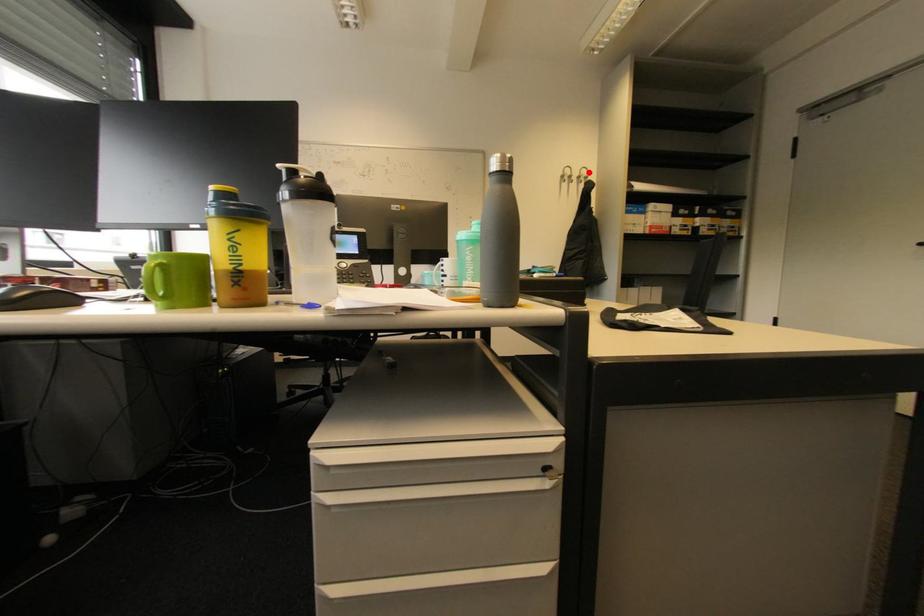
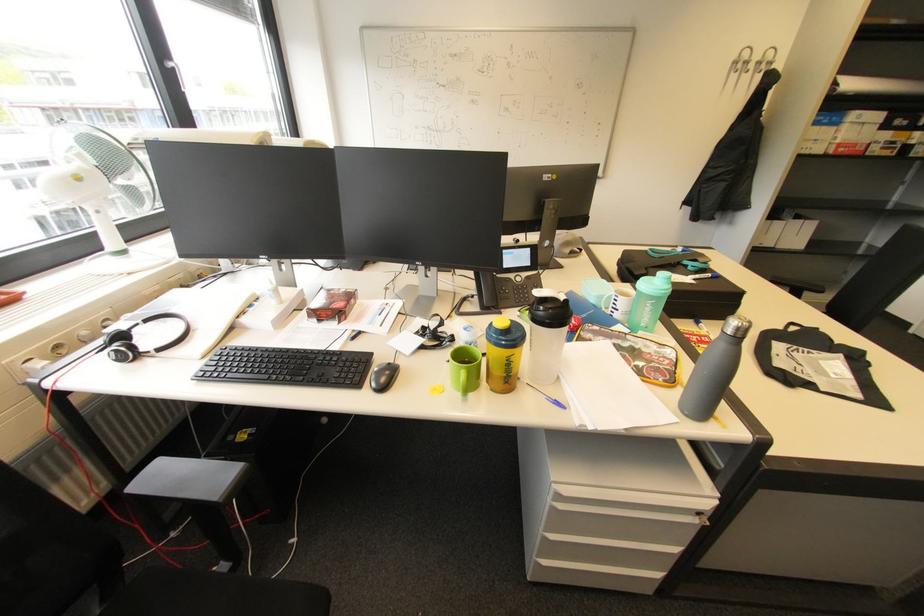
Question: I am providing you with two images of the same scene from different viewpoints. In image1, a red point is highlighted. Considering the same 3D point in image2, which of the following is correct?

Choices:
 (A) It is closer
 (B) It is farther

Answer: (B)